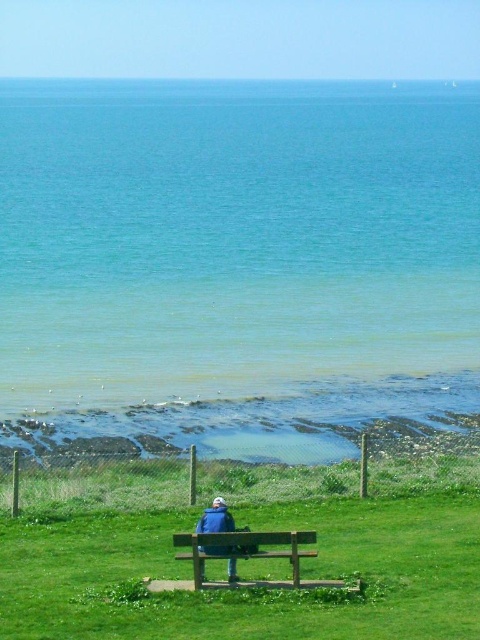
Can you confirm if clear blue water at center is positioned to the left of blue fabric jacket at center?

Yes, clear blue water at center is to the left of blue fabric jacket at center.

Which is behind, point (104, 230) or point (228, 524)?

Positioned behind is point (104, 230).

Image resolution: width=480 pixels, height=640 pixels. Identify the location of clear blue water at center. (238, 266).

Is the position of green grassy bench at lower center more distant than that of brown wooden bench at center?

Yes.

Which is in front, point (63, 566) or point (309, 534)?

Point (309, 534) is more forward.

I want to click on green grassy bench at lower center, so coord(245,589).

Is green grassy bench at lower center to the left of blue fabric jacket at center from the viewer's perspective?

Yes, green grassy bench at lower center is to the left of blue fabric jacket at center.

Who is lower down, green grassy bench at lower center or blue fabric jacket at center?

green grassy bench at lower center is lower down.

Locate an element on the screen. The height and width of the screenshot is (640, 480). green grassy bench at lower center is located at coordinates (245, 589).